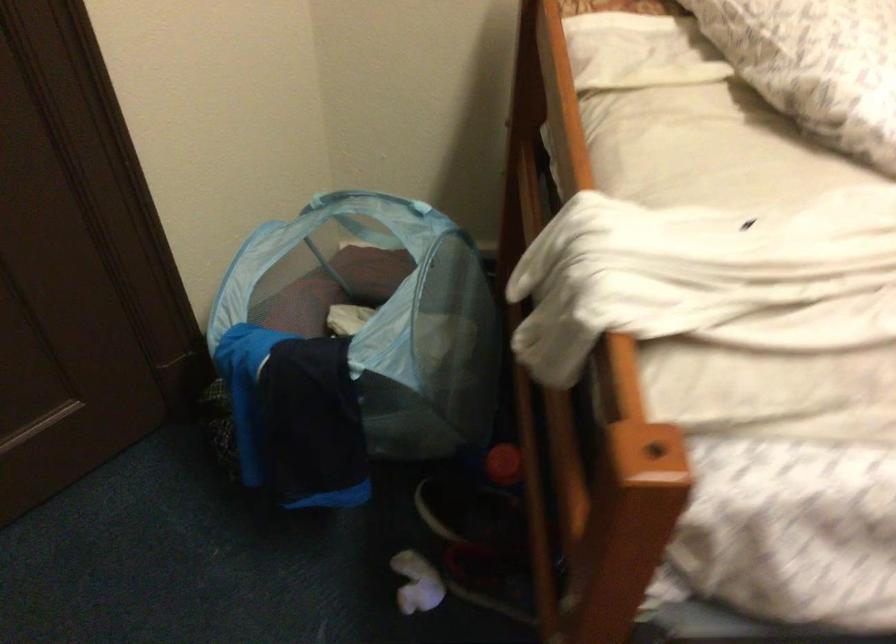
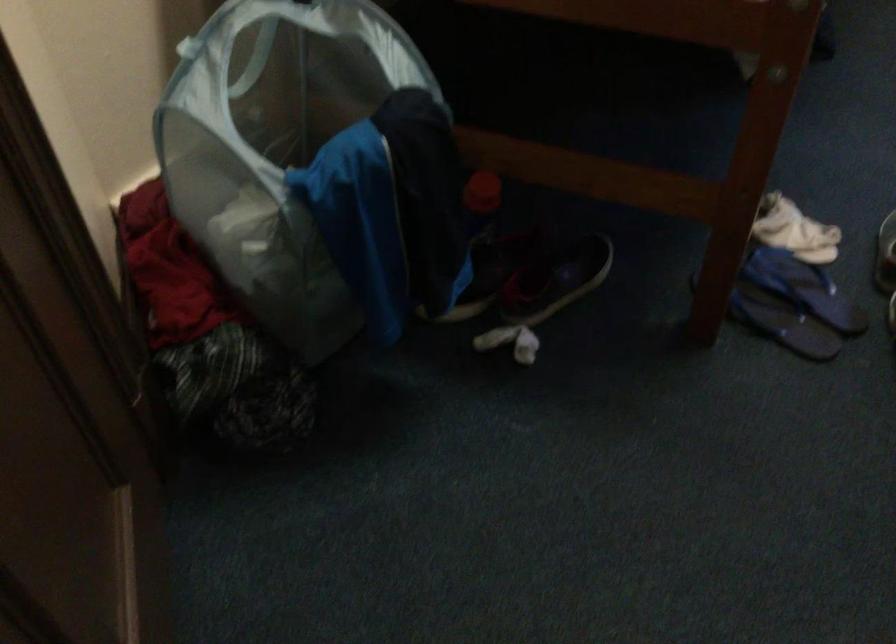
Locate, in the second image, the point that corresponds to pixel 317 198 in the first image.

(186, 46)